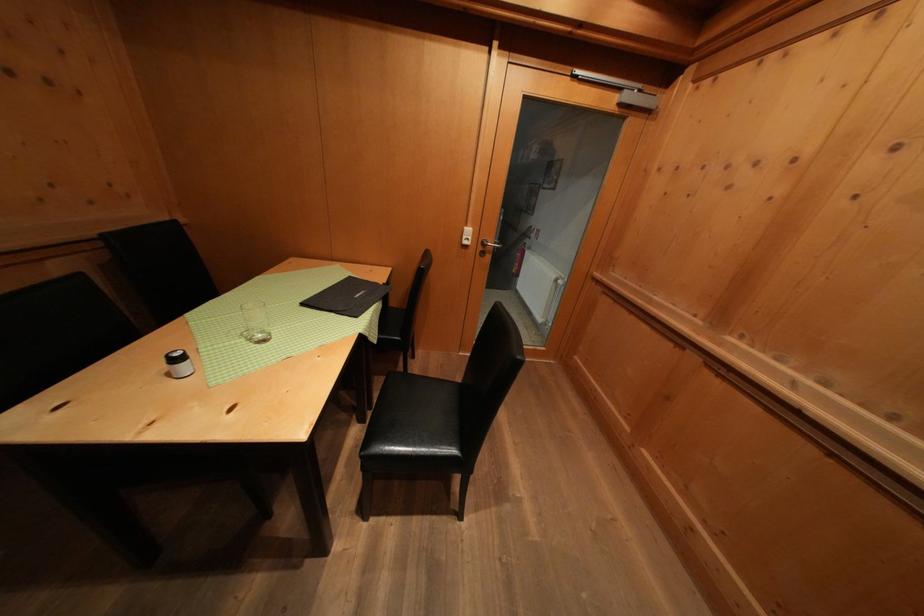
The width and height of the screenshot is (924, 616). What do you see at coordinates (490, 246) in the screenshot?
I see `the silver door handle` at bounding box center [490, 246].